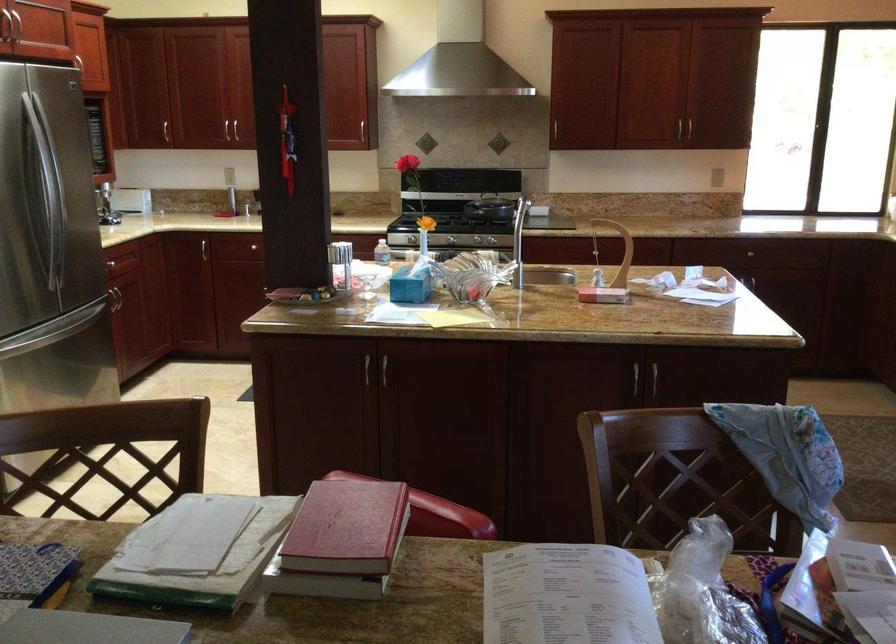
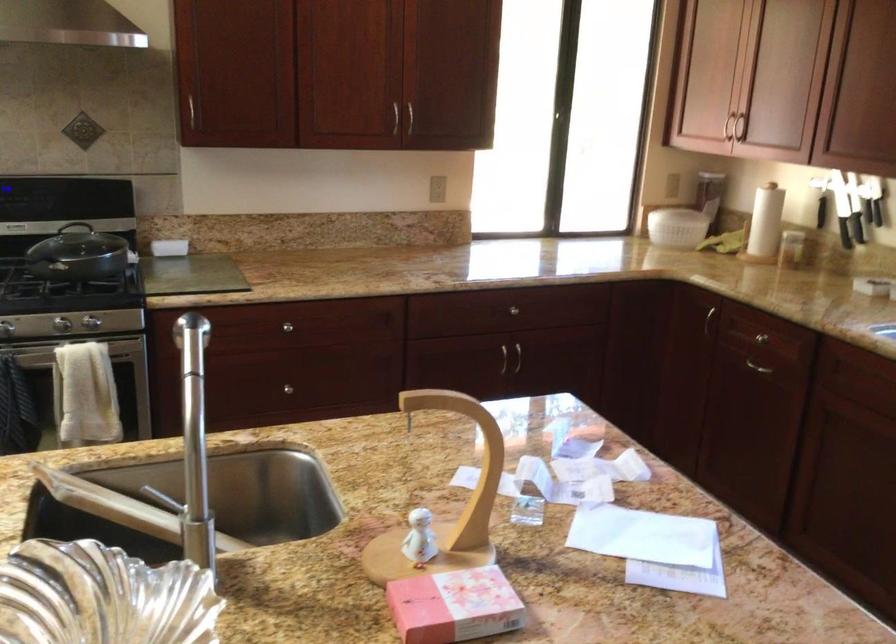
Question: In a continuous first-person perspective shot, in which direction is the camera moving?

Choices:
 (A) Left
 (B) Right
 (C) Forward
 (D) Backward

Answer: (C)